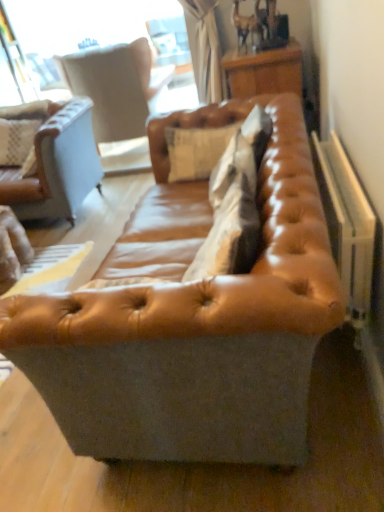
Question: Is point (208, 141) positioned closer to the camera than point (59, 193)?

Choices:
 (A) farther
 (B) closer

Answer: (B)

Question: Considering their positions, is leather cushion at center located in front of or behind brown leather couch at left, the second studio couch positioned from the right?

Choices:
 (A) behind
 (B) front

Answer: (B)

Question: Estimate the real-world distances between objects in this image. Which object is closer to the wooden table at upper right?

Choices:
 (A) light beige leather swivel chair at upper left
 (B) leather cushion at center
 (C) leather couch at center, the first studio couch positioned from the front
 (D) white plastic radiator at right
 (E) brown leather couch at left, the first studio couch viewed from the back

Answer: (B)

Question: Based on their relative distances, which object is farther from the leather cushion at center?

Choices:
 (A) leather couch at center, the second studio couch when ordered from left to right
 (B) light beige leather swivel chair at upper left
 (C) white plastic radiator at right
 (D) wooden table at upper right
 (E) brown leather couch at left, the second studio couch positioned from the right

Answer: (B)